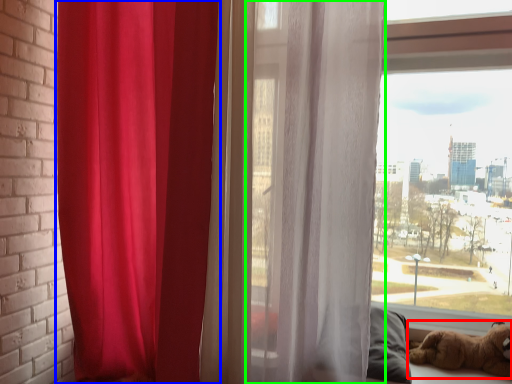
Question: Which object is positioned farthest from dog (highlighted by a red box)? Select from curtain (highlighted by a blue box) and curtain (highlighted by a green box).

Choices:
 (A) curtain
 (B) curtain

Answer: (A)